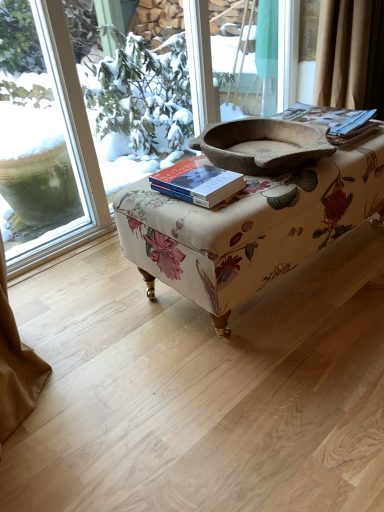
What are the coordinates of `unoccupied region to the right of hardcover book at center, the first paperback book positioned from the left` in the screenshot? It's located at (267, 188).